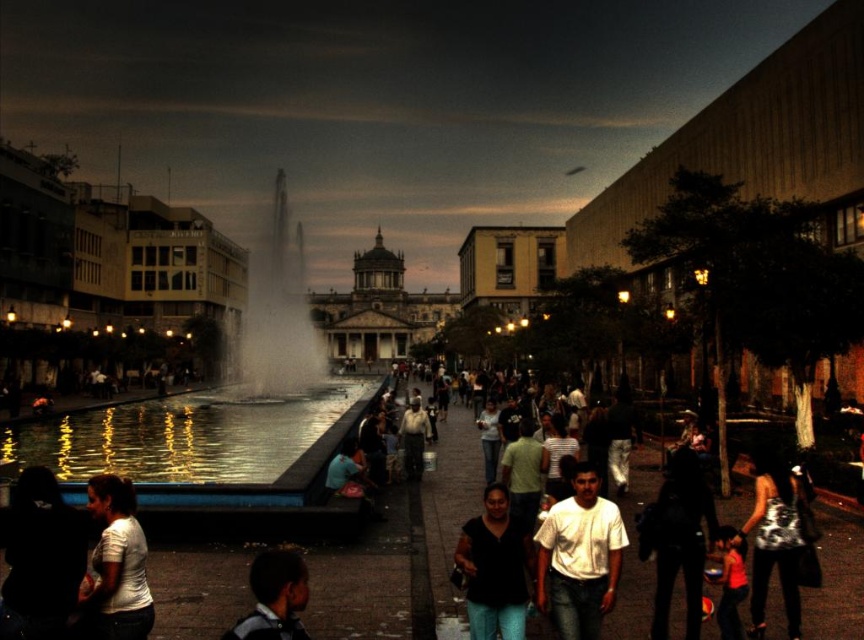
You are a photographer standing at the edge of the plaza. You want to capture a photo that includes both the white matte shirt at center and the dark skin human head at lower center. Based on their positions, which object should appear larger in the photo?

The white matte shirt at center should appear larger in the photo because it is taller than the dark skin human head at lower center.

You are a photographer planning to take a portrait of the dark skin human head at lower center while capturing the reflective glass fountain at center in the background. Considering the distance between them, will the fountain appear smaller or larger in the photo compared to the human head?

The reflective glass fountain at center is wider than the dark skin human head at lower center, so in the photo, the fountain will appear larger than the human head when both are in focus and the photographer maintains a consistent distance from both subjects.

You are standing in the plaza and see the reflective glass fountain at center and the dark skin human head at lower center. Which object is positioned to the left from your perspective?

The reflective glass fountain at center is to the left of the dark skin human head at lower center from your perspective.